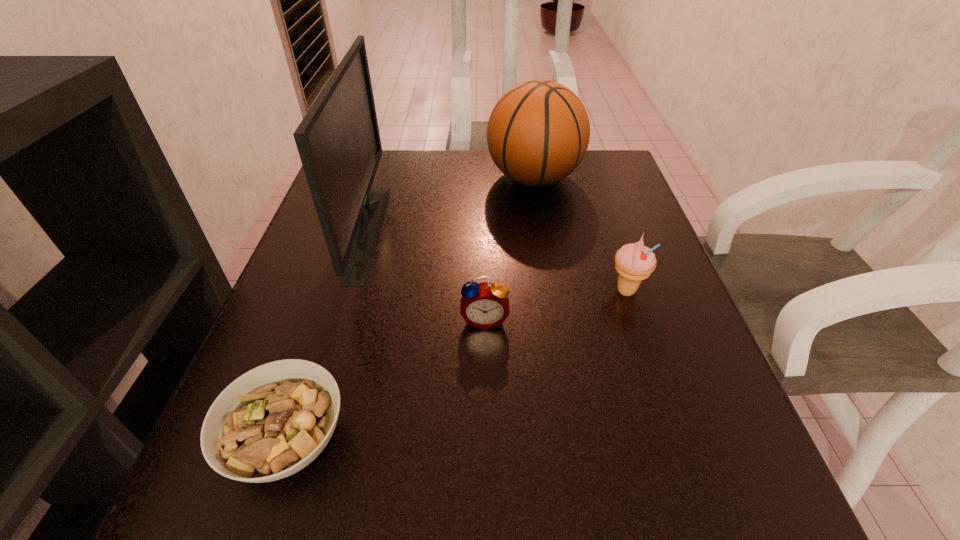
The height and width of the screenshot is (540, 960). Identify the location of vacant space situated on the front-facing side of the second nearest object. (486, 414).

The height and width of the screenshot is (540, 960). I want to click on blank space located on the right of the shortest object, so click(385, 441).

The height and width of the screenshot is (540, 960). I want to click on monitor that is at the far edge, so click(x=338, y=140).

Where is `basketball present at the far edge`? basketball present at the far edge is located at coordinates (538, 132).

The image size is (960, 540). In order to click on object present at the near edge in this screenshot , I will do `click(271, 422)`.

Locate an element on the screen. This screenshot has width=960, height=540. monitor that is at the left edge is located at coordinates (338, 140).

The width and height of the screenshot is (960, 540). In order to click on stew positioned at the left edge in this screenshot , I will do `click(271, 422)`.

Where is `basketball present at the right edge`? basketball present at the right edge is located at coordinates (538, 132).

Where is `icecream located at the right edge`? icecream located at the right edge is located at coordinates (634, 262).

This screenshot has height=540, width=960. Find the location of `object at the far left corner`. object at the far left corner is located at coordinates (338, 140).